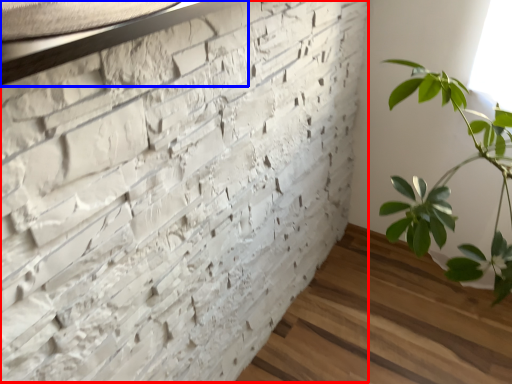
Question: Which object is closer to the camera taking this photo, brickwork (highlighted by a red box) or window sill (highlighted by a blue box)?

Choices:
 (A) brickwork
 (B) window sill

Answer: (A)